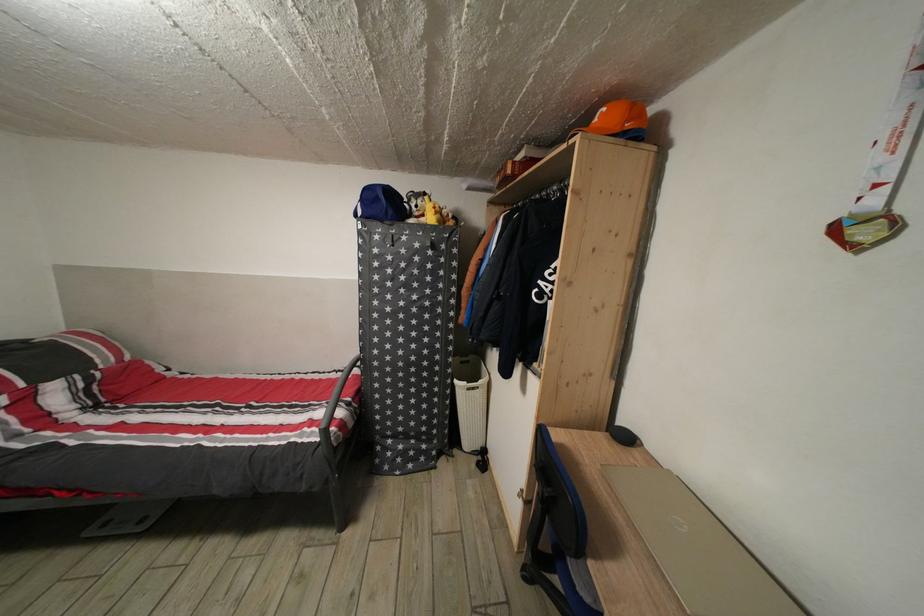
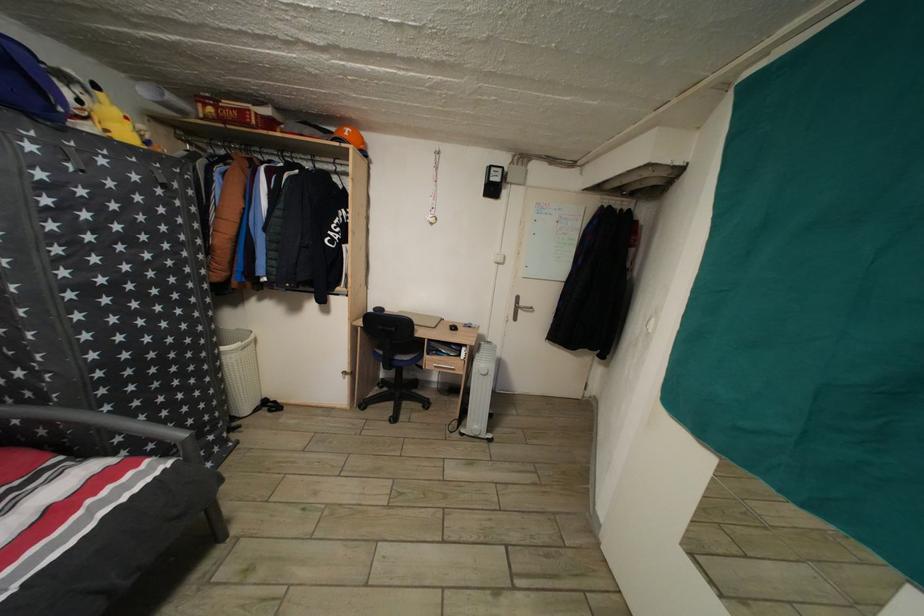
Locate, in the second image, the point that corresponds to [463,387] in the first image.

(229, 355)